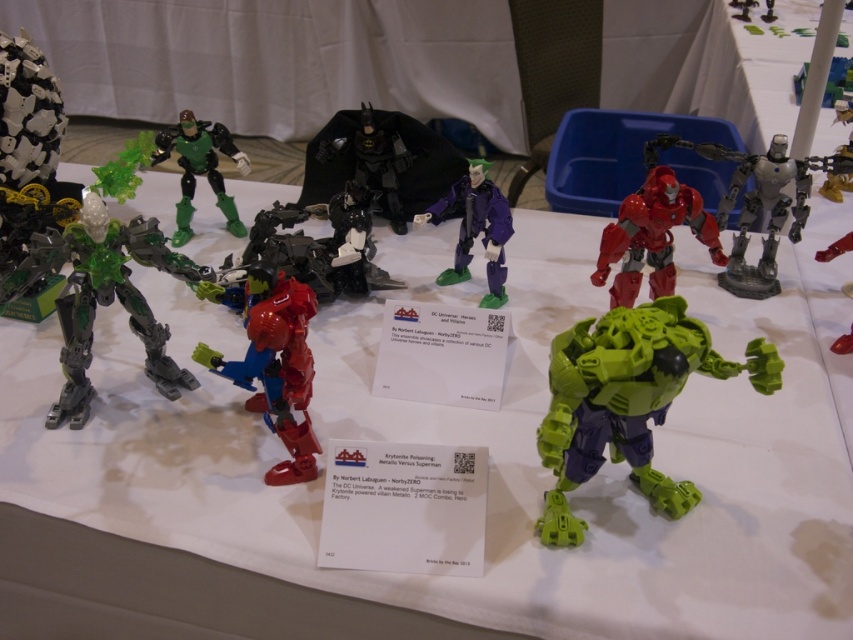
Can you confirm if green metallic robot at left is thinner than shiny red plastic robot at center?

In fact, green metallic robot at left might be wider than shiny red plastic robot at center.

Is green metallic robot at left to the right of shiny red plastic robot at center from the viewer's perspective?

No, green metallic robot at left is not to the right of shiny red plastic robot at center.

Does point (24, 282) lie behind point (305, 358)?

Yes, point (24, 282) is farther from viewer.

Identify the location of green metallic robot at left. (103, 296).

Does metallic silver robot at right have a larger size compared to matte black batman at center?

Actually, metallic silver robot at right might be smaller than matte black batman at center.

Does metallic silver robot at right appear on the right side of matte black batman at center?

Incorrect, metallic silver robot at right is not on the right side of matte black batman at center.

The width and height of the screenshot is (853, 640). I want to click on metallic silver robot at right, so click(x=834, y=248).

Identify the location of metallic silver robot at right. This screenshot has height=640, width=853. (834, 248).

Consider the image. Which is below, green matte hulk at center or green metallic robot at left?

Positioned lower is green matte hulk at center.

Does point (761, 339) come in front of point (129, 250)?

Yes, it is in front of point (129, 250).

Locate an element on the screen. The image size is (853, 640). green matte hulk at center is located at coordinates (627, 401).